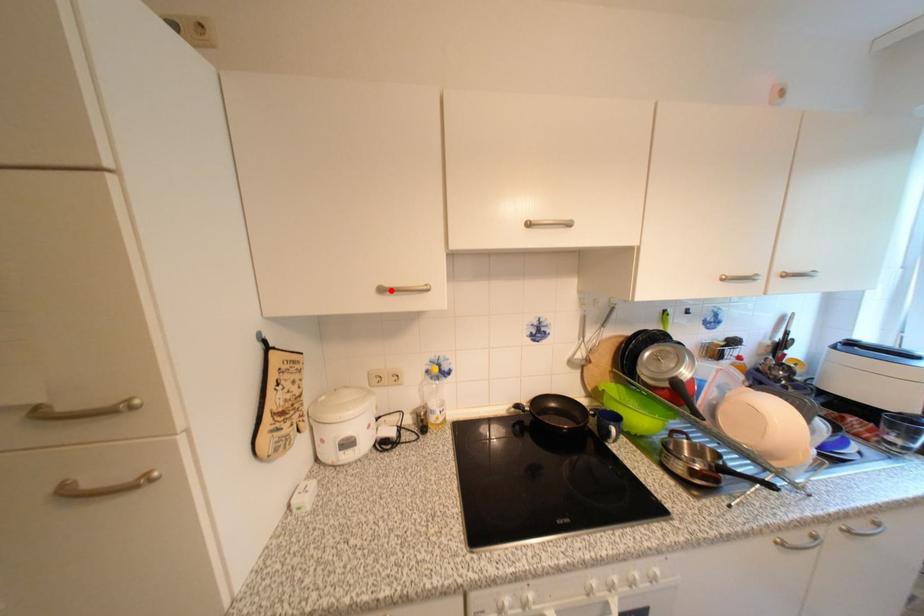
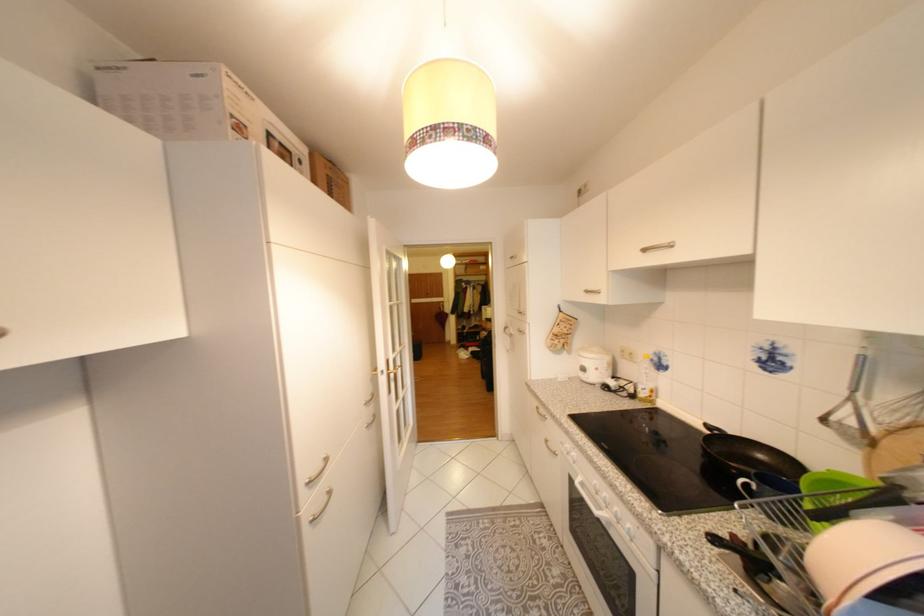
Where in the second image is the point corresponding to the highlighted location from the first image?

(596, 292)